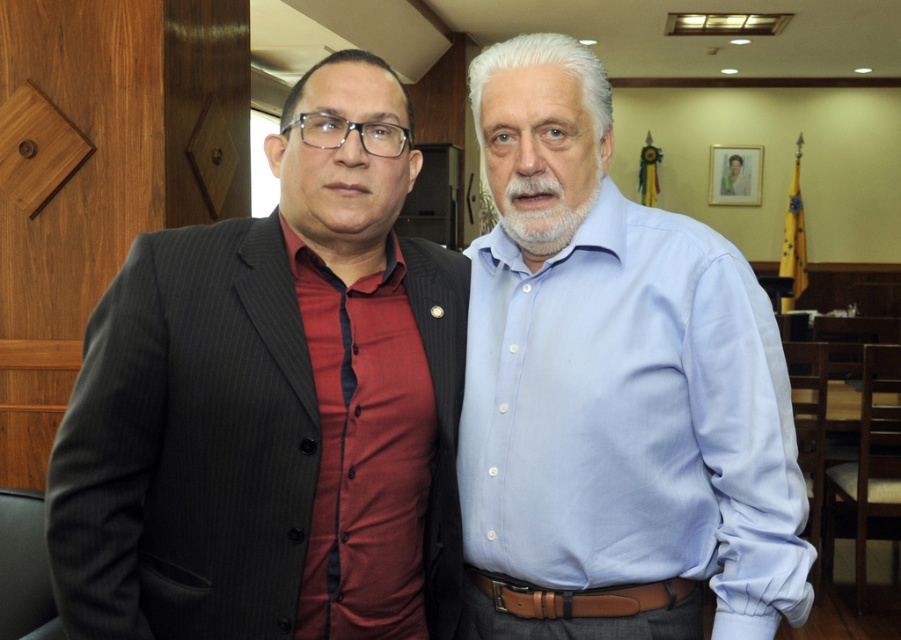
Who is lower down, light blue shirt at center or matte black suit at left?

matte black suit at left

What do you see at coordinates (613, 388) in the screenshot? I see `light blue shirt at center` at bounding box center [613, 388].

Where is `light blue shirt at center`? Image resolution: width=901 pixels, height=640 pixels. light blue shirt at center is located at coordinates (613, 388).